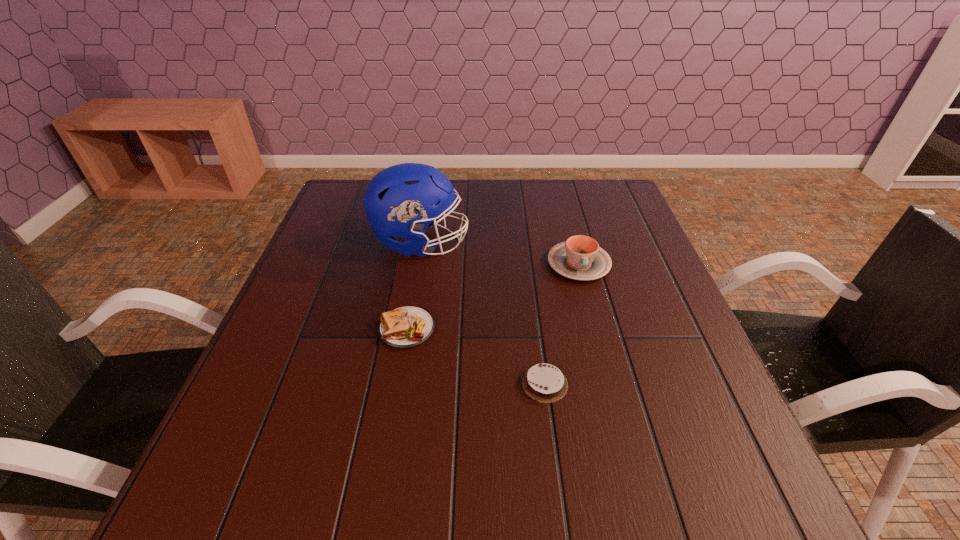
You are a GUI agent. You are given a task and a screenshot of the screen. Output one action in this format:
    pyautogui.click(x=<x>, y=<y>)
    Task: Click on the vacant space that's between the football helmet and the second object from right to left
    The width and height of the screenshot is (960, 540).
    Given the screenshot: What is the action you would take?
    pyautogui.click(x=483, y=313)

Image resolution: width=960 pixels, height=540 pixels. Find the location of `empty space that is in between the third farthest object and the chocolate cake`. empty space that is in between the third farthest object and the chocolate cake is located at coordinates (476, 356).

The width and height of the screenshot is (960, 540). In order to click on unoccupied area between the chocolate cake and the third shortest object in this screenshot , I will do `click(562, 323)`.

Identify the location of free space between the sandwich and the football helmet. The height and width of the screenshot is (540, 960). (414, 286).

The height and width of the screenshot is (540, 960). I want to click on unoccupied position between the football helmet and the nearest object, so click(x=483, y=313).

Locate an element on the screen. free space between the sandwich and the nearest object is located at coordinates (476, 356).

Where is `free point between the sandwich and the tallest object`? This screenshot has width=960, height=540. free point between the sandwich and the tallest object is located at coordinates [x=414, y=286].

The width and height of the screenshot is (960, 540). Identify the location of empty space that is in between the tallest object and the third object from left to right. (483, 313).

This screenshot has width=960, height=540. Find the location of `free space between the shortest object and the tallest object`. free space between the shortest object and the tallest object is located at coordinates (483, 313).

Choose which object is the third nearest neighbor to the rightmost object. Please provide its 2D coordinates. Your answer should be formatted as a tuple, i.e. [(x, y)], where the tuple contains the x and y coordinates of a point satisfying the conditions above.

[(406, 327)]